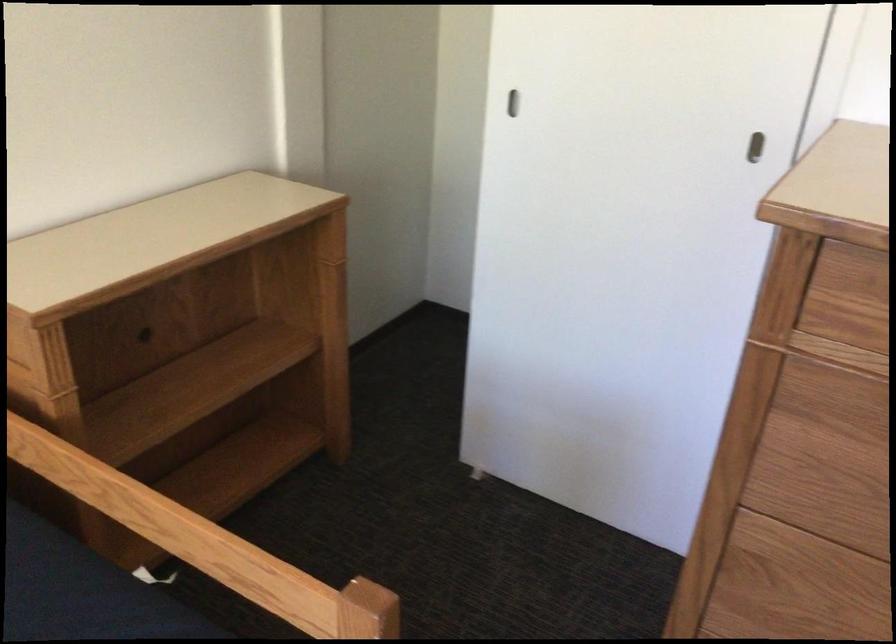
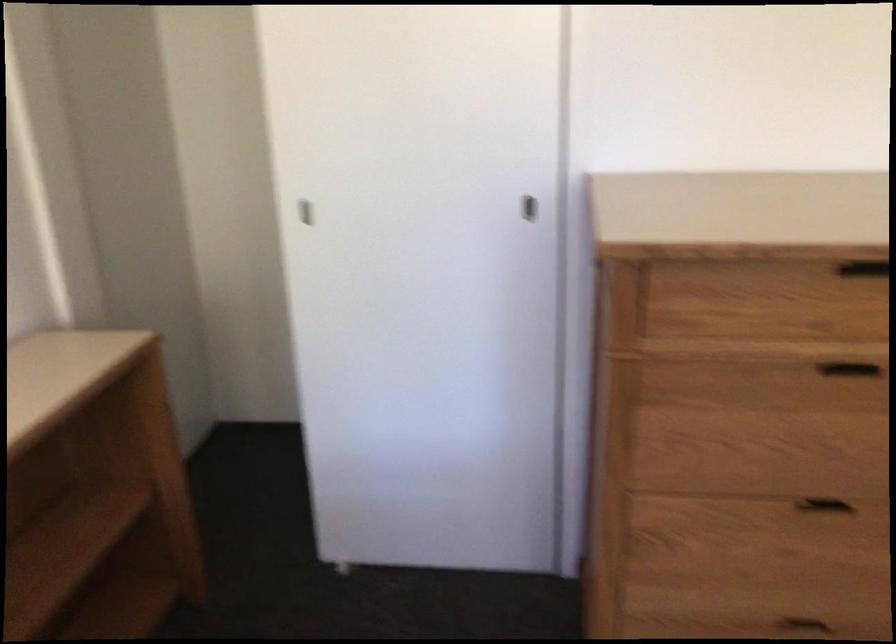
Question: In a continuous first-person perspective shot, in which direction is the camera moving?

Choices:
 (A) Left
 (B) Right
 (C) Forward
 (D) Backward

Answer: (A)